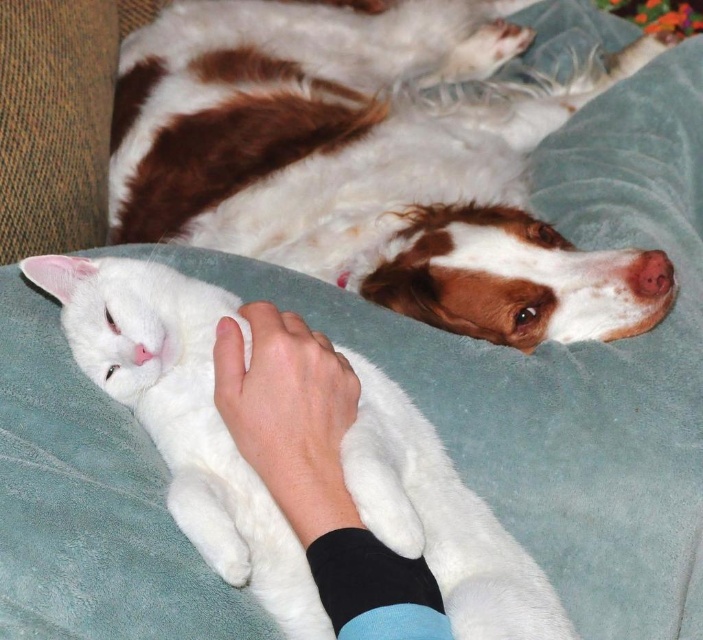
You are a photographer trying to capture a closeup of the brown and white fur at upper center and the white fluffy cat at center. Which animal should you focus on first to ensure it appears sharp in the photo?

The brown and white fur at upper center is closer to the photographer, so focusing on it first will ensure it appears sharp. The white fluffy cat at center is slightly farther away, so adjusting focus accordingly would help capture both clearly.

You are a robotic pet groomer who needs to reach both the brown and white fur at upper center and the black fleece sleeve at lower center. Your robotic arm has a maximum reach of 22 inches. Can you reach both objects without moving your position?

The brown and white fur at upper center is 22.21 inches away from the black fleece sleeve at lower center. Since the robotic arm can only reach 22 inches, it cannot reach the brown and white fur at upper center from the black fleece sleeve at lower center without moving its position.